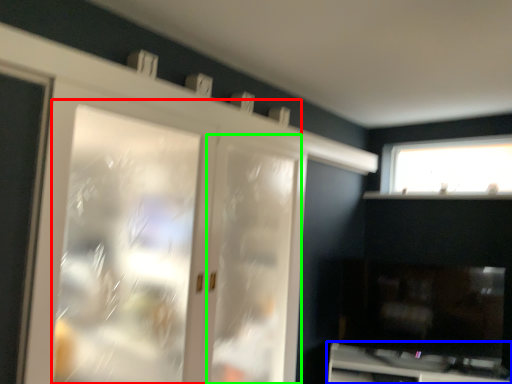
Question: Which is nearer to the screen door (highlighted by a red box)? cabinetry (highlighted by a blue box) or screen door (highlighted by a green box).

Choices:
 (A) cabinetry
 (B) screen door

Answer: (B)